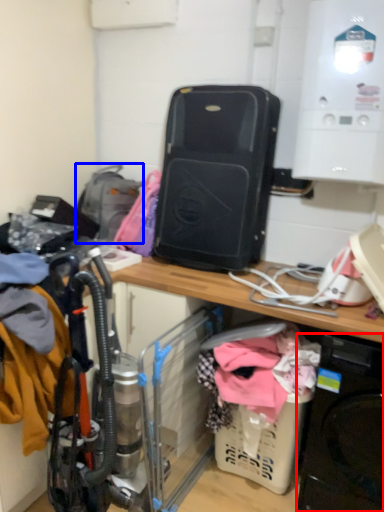
Question: Which object appears closest to the camera in this image, washing machine (highlighted by a red box) or backpack (highlighted by a blue box)?

Choices:
 (A) washing machine
 (B) backpack

Answer: (A)